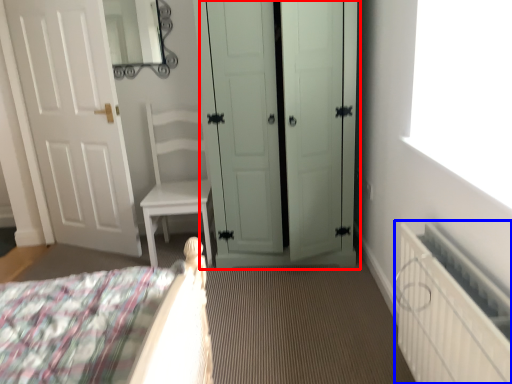
Question: Which object is further to the camera taking this photo, door (highlighted by a red box) or radiator (highlighted by a blue box)?

Choices:
 (A) door
 (B) radiator

Answer: (A)